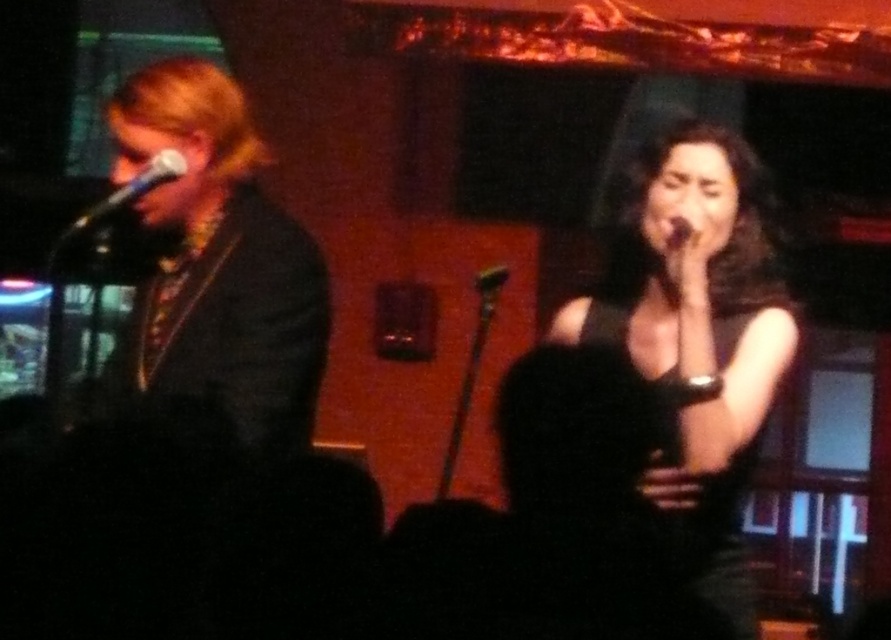
Question: Which object is closer to the camera taking this photo?

Choices:
 (A) black matte dress at center
 (B) metallic silver microphone at left

Answer: (A)

Question: Which point is closer to the camera?

Choices:
 (A) (741, 570)
 (B) (229, 230)
 (C) (492, 291)
 (D) (154, 182)

Answer: (D)

Question: Is black matte dress at center below shiny black jacket at left?

Choices:
 (A) no
 (B) yes

Answer: (B)

Question: Is black matte dress at center bigger than black matte microphone at center?

Choices:
 (A) no
 (B) yes

Answer: (B)

Question: Where is shiny black jacket at left located in relation to metallic silver microphone at left in the image?

Choices:
 (A) right
 (B) left

Answer: (A)

Question: Which object appears farthest from the camera in this image?

Choices:
 (A) shiny black jacket at left
 (B) black matte microphone at center
 (C) black matte dress at center
 (D) metallic silver microphone at left

Answer: (B)